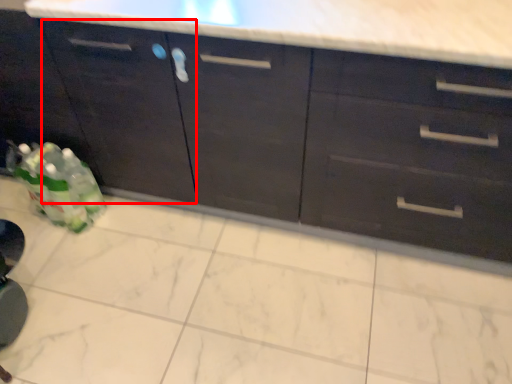
Question: Considering the relative positions of cabinetry (annotated by the red box) and cabinetry in the image provided, where is cabinetry (annotated by the red box) located with respect to the staircase?

Choices:
 (A) left
 (B) right

Answer: (A)